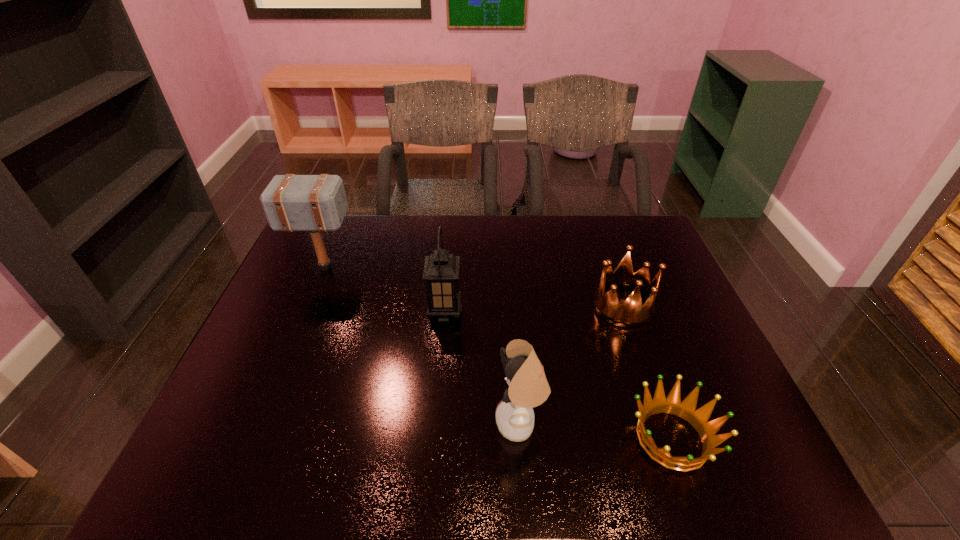
At what (x,y) coordinates should I click in order to perform the action: click on object that is at the near right corner. Please return your answer as a coordinate pair (x, y). This screenshot has width=960, height=540. Looking at the image, I should click on (686, 409).

The width and height of the screenshot is (960, 540). What are the coordinates of `vacant space at the far edge of the desktop` in the screenshot? It's located at (574, 233).

Find the location of a particular element. This screenshot has height=540, width=960. vacant space at the near edge of the desktop is located at coordinates (588, 458).

You are a GUI agent. You are given a task and a screenshot of the screen. Output one action in this format:
    pyautogui.click(x=<x>, y=<y>)
    Task: Click on the free location at the left edge of the desktop
    Image resolution: width=960 pixels, height=540 pixels.
    Given the screenshot: What is the action you would take?
    pyautogui.click(x=248, y=360)

Find the location of `free space at the right edge`. free space at the right edge is located at coordinates (666, 322).

Locate an element on the screen. vacant space at the far right corner of the desktop is located at coordinates (616, 234).

This screenshot has width=960, height=540. I want to click on free spot between the third object from left to right and the farthest object, so click(422, 346).

You are a GUI agent. You are given a task and a screenshot of the screen. Output one action in this format:
    pyautogui.click(x=<x>, y=<y>)
    Task: Click on the vacant area between the shortest object and the lantern
    The image size is (960, 540).
    Given the screenshot: What is the action you would take?
    pyautogui.click(x=559, y=375)

Find the location of a particular element. Image resolution: width=960 pixels, height=540 pixels. free space between the fourth object from right to left and the third object from right to left is located at coordinates (483, 368).

Where is `free space between the third object from left to right and the lantern`? free space between the third object from left to right and the lantern is located at coordinates (483, 368).